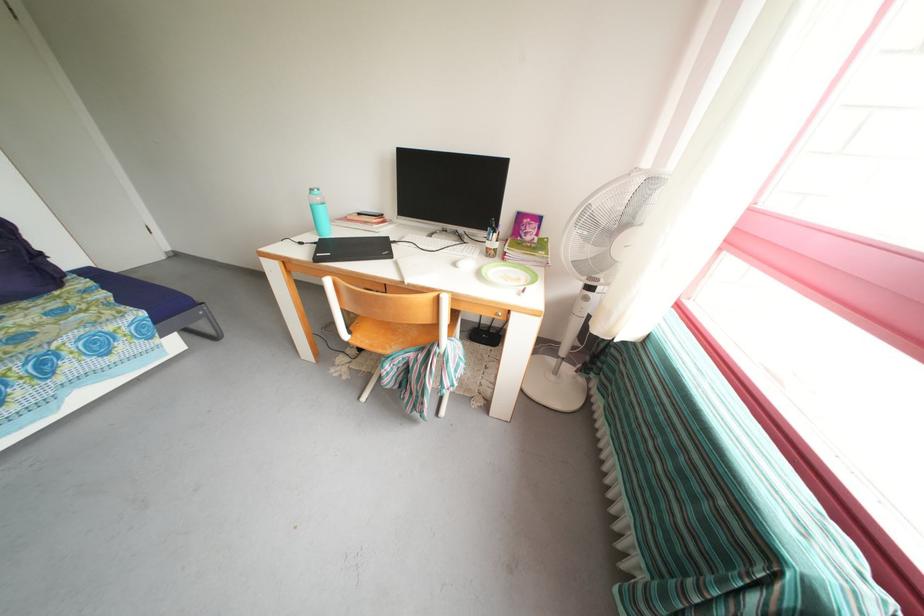
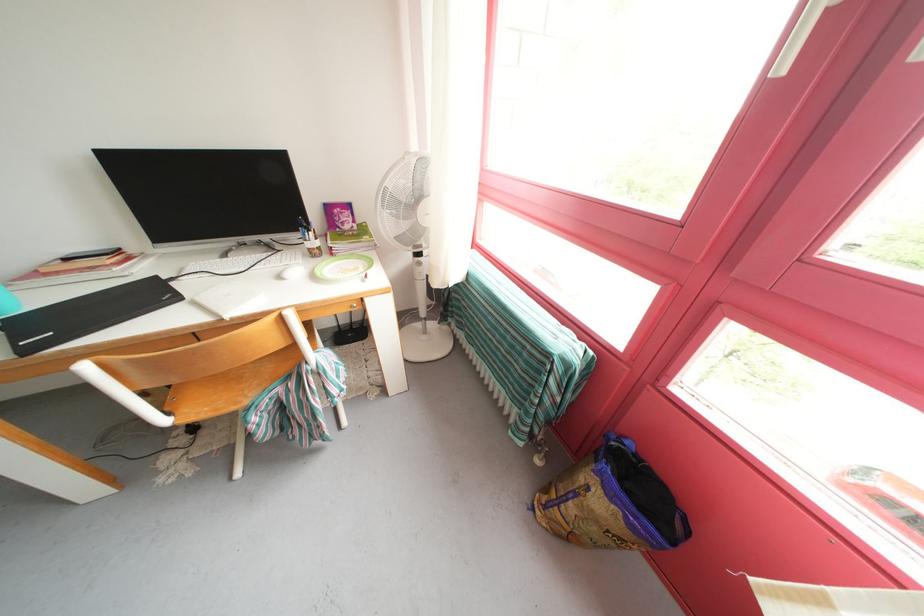
The point at (466, 257) is marked in the first image. Where is the corresponding point in the second image?

(284, 267)